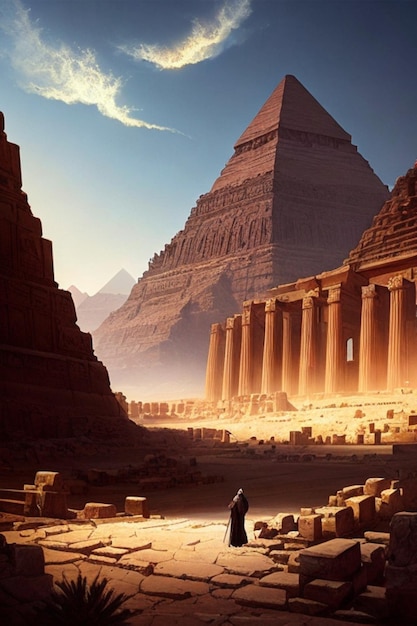
Where is `column`? This screenshot has width=417, height=626. column is located at coordinates (209, 367), (230, 391), (247, 386), (268, 376), (288, 347), (302, 361), (329, 366), (362, 377), (393, 382).